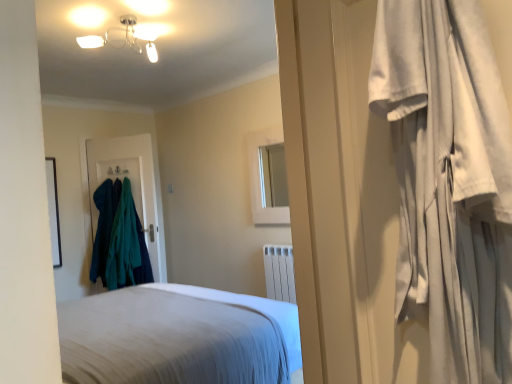
Question: In which direction should I rotate to look at white soft bed at center, acting as the 2th bed starting from the front?

Choices:
 (A) left
 (B) right

Answer: (A)

Question: From a real-world perspective, is white soft bed at center, the 1th bed positioned from the front, below teal fabric coat hanger at left?

Choices:
 (A) yes
 (B) no

Answer: (B)

Question: Considering the relative sizes of white soft bed at center, which is counted as the second bed, starting from the back, and teal fabric coat hanger at left in the image provided, is white soft bed at center, which is counted as the second bed, starting from the back, shorter than teal fabric coat hanger at left?

Choices:
 (A) no
 (B) yes

Answer: (B)

Question: Is white soft bed at center, which is counted as the second bed, starting from the back, aimed at teal fabric coat hanger at left?

Choices:
 (A) yes
 (B) no

Answer: (B)

Question: Can you confirm if white soft bed at center, the 1th bed positioned from the front, is positioned to the right of teal fabric coat hanger at left?

Choices:
 (A) no
 (B) yes

Answer: (B)

Question: From the image's perspective, would you say white soft bed at center, the 1th bed positioned from the front, is positioned over teal fabric coat hanger at left?

Choices:
 (A) no
 (B) yes

Answer: (B)

Question: Is teal fabric coat hanger at left completely or partially inside white soft bed at center, which is counted as the second bed, starting from the back?

Choices:
 (A) no
 (B) yes

Answer: (A)

Question: Is white cotton curtain at right not within teal woolen sweater at left, the first clothing positioned from the right?

Choices:
 (A) no
 (B) yes

Answer: (B)

Question: Does white cotton curtain at right have a lesser width compared to teal woolen sweater at left, the first clothing positioned from the right?

Choices:
 (A) yes
 (B) no

Answer: (A)

Question: Is white cotton curtain at right in front of teal woolen sweater at left, acting as the 2th clothing starting from the left?

Choices:
 (A) yes
 (B) no

Answer: (A)

Question: Is white cotton curtain at right oriented towards teal woolen sweater at left, acting as the 2th clothing starting from the left?

Choices:
 (A) no
 (B) yes

Answer: (A)

Question: Considering the relative sizes of white cotton curtain at right and teal woolen sweater at left, the first clothing positioned from the right, in the image provided, is white cotton curtain at right smaller than teal woolen sweater at left, the first clothing positioned from the right,?

Choices:
 (A) yes
 (B) no

Answer: (A)

Question: From the image's perspective, is white cotton curtain at right located beneath teal woolen sweater at left, the first clothing positioned from the right?

Choices:
 (A) yes
 (B) no

Answer: (B)

Question: From a real-world perspective, is metallic glass chandelier at upper center located higher than white soft bed at center, marked as the second bed in a bottom-to-top arrangement?

Choices:
 (A) yes
 (B) no

Answer: (A)